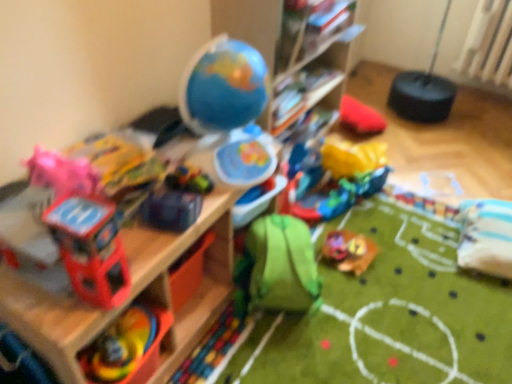
At what (x,y) coordinates should I click in order to perform the action: click on free space to the back side of matte plastic toy helicopter at left, which ranks as the fifth toy in back-to-front order. Please return your answer as a coordinate pair (x, y). The width and height of the screenshot is (512, 384). Looking at the image, I should click on (143, 250).